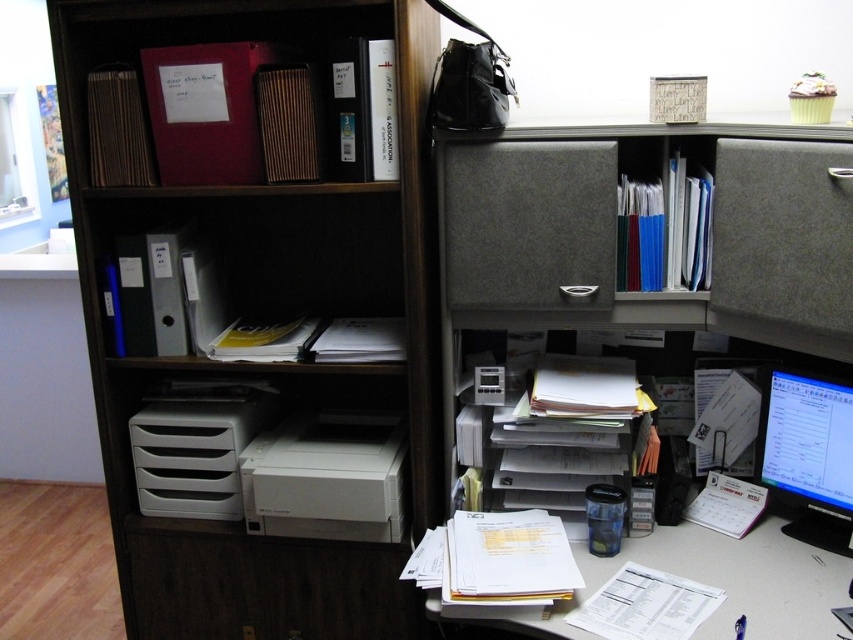
Question: Which object appears closest to the camera in this image?

Choices:
 (A) white matte printer at center
 (B) felt/dark gray drawer at upper right
 (C) gray fabric bookcase at right
 (D) matte plastic shelves at upper left

Answer: (B)

Question: Can you confirm if wooden bookshelf at left is positioned to the right of matte black monitor at right?

Choices:
 (A) no
 (B) yes

Answer: (A)

Question: Can you confirm if white plastic printer at center is smaller than matte black monitor at right?

Choices:
 (A) yes
 (B) no

Answer: (B)

Question: Estimate the real-world distances between objects in this image. Which object is farther from the matte black monitor at right?

Choices:
 (A) gray fabric bookcase at right
 (B) felt/dark gray drawer at upper right
 (C) gray fabric drawer at center
 (D) matte plastic shelves at upper left

Answer: (D)

Question: Is gray fabric bookcase at right wider than white plastic printer at center?

Choices:
 (A) yes
 (B) no

Answer: (A)

Question: Among these points, which one is nearest to the camera?

Choices:
 (A) (810, 493)
 (B) (509, 273)

Answer: (B)